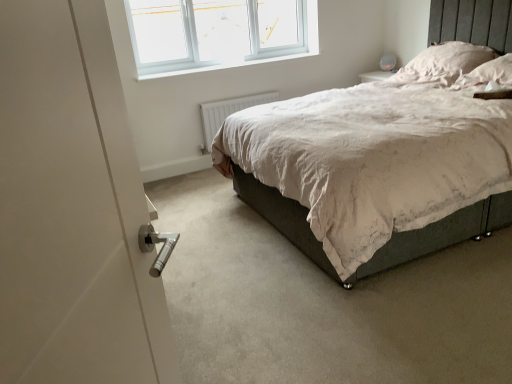
Question: Does white soft pillow at upper right, which is the second pillow from front to back, have a lesser width compared to white soft pillow at upper right, placed as the 1th pillow when sorted from front to back?

Choices:
 (A) yes
 (B) no

Answer: (B)

Question: Is white soft pillow at upper right, which is the second pillow from front to back, outside white soft pillow at upper right, placed as the 1th pillow when sorted from front to back?

Choices:
 (A) no
 (B) yes

Answer: (B)

Question: Does white soft pillow at upper right, which is the second pillow from front to back, contain white soft pillow at upper right, placed as the 1th pillow when sorted from front to back?

Choices:
 (A) yes
 (B) no

Answer: (B)

Question: Is there a large distance between white soft pillow at upper right, the 1th pillow when ordered from back to front, and white soft pillow at upper right, the second pillow when ordered from back to front?

Choices:
 (A) no
 (B) yes

Answer: (A)

Question: Is white soft pillow at upper right, placed as the 1th pillow when sorted from front to back, at the back of white soft pillow at upper right, the 1th pillow when ordered from back to front?

Choices:
 (A) no
 (B) yes

Answer: (A)

Question: Does point (468, 64) appear closer or farther from the camera than point (177, 74)?

Choices:
 (A) farther
 (B) closer

Answer: (B)

Question: Considering the positions of white soft pillow at upper right, which is the second pillow from front to back, and white smooth window sill at upper center in the image, is white soft pillow at upper right, which is the second pillow from front to back, wider or thinner than white smooth window sill at upper center?

Choices:
 (A) thin
 (B) wide

Answer: (B)

Question: Do you think white soft pillow at upper right, which is the second pillow from front to back, is within white smooth window sill at upper center, or outside of it?

Choices:
 (A) inside
 (B) outside

Answer: (B)

Question: Based on their sizes in the image, would you say white soft pillow at upper right, the 1th pillow when ordered from back to front, is bigger or smaller than white smooth window sill at upper center?

Choices:
 (A) big
 (B) small

Answer: (A)

Question: Based on their sizes in the image, would you say white matte radiator at lower center is bigger or smaller than white plastic window at upper center?

Choices:
 (A) small
 (B) big

Answer: (A)

Question: In terms of height, does white matte radiator at lower center look taller or shorter compared to white plastic window at upper center?

Choices:
 (A) tall
 (B) short

Answer: (B)

Question: In the image, is white matte radiator at lower center positioned in front of or behind white plastic window at upper center?

Choices:
 (A) behind
 (B) front

Answer: (A)

Question: Is point (246, 102) positioned closer to the camera than point (142, 31)?

Choices:
 (A) farther
 (B) closer

Answer: (A)

Question: Considering the positions of white smooth window sill at upper center and white soft pillow at upper right, the second pillow when ordered from back to front, in the image, is white smooth window sill at upper center bigger or smaller than white soft pillow at upper right, the second pillow when ordered from back to front,?

Choices:
 (A) small
 (B) big

Answer: (A)

Question: From their relative heights in the image, would you say white smooth window sill at upper center is taller or shorter than white soft pillow at upper right, placed as the 1th pillow when sorted from front to back?

Choices:
 (A) short
 (B) tall

Answer: (A)